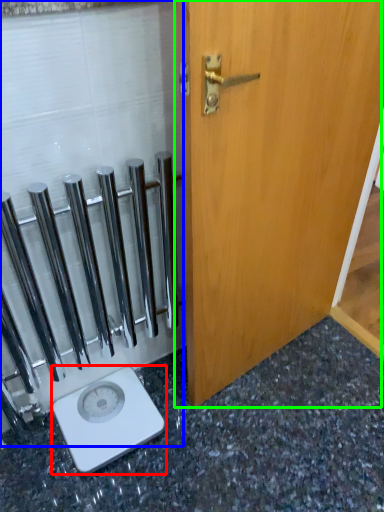
Question: Based on their relative distances, which object is nearer to scale (highlighted by a red box)? Choose from glass door (highlighted by a blue box) and door (highlighted by a green box).

Choices:
 (A) glass door
 (B) door

Answer: (A)